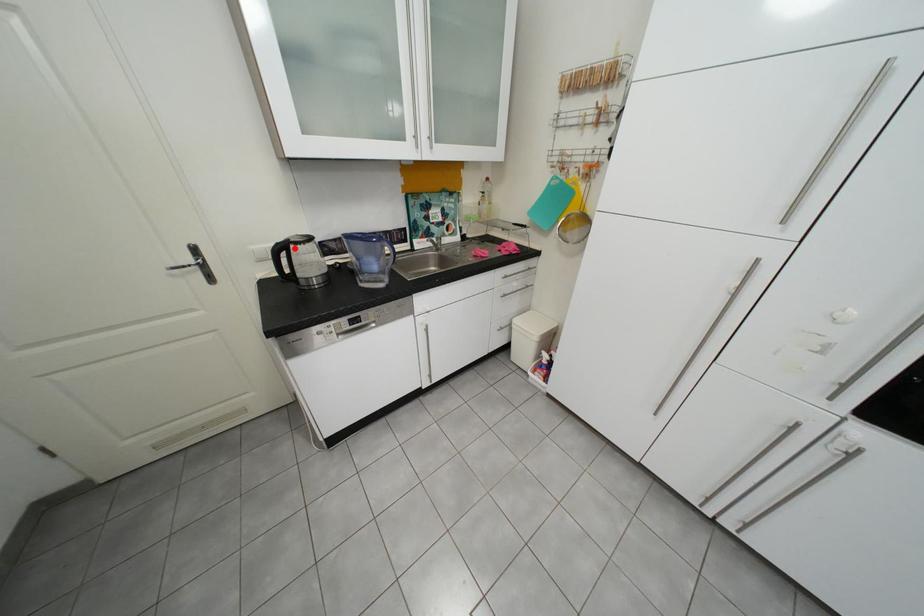
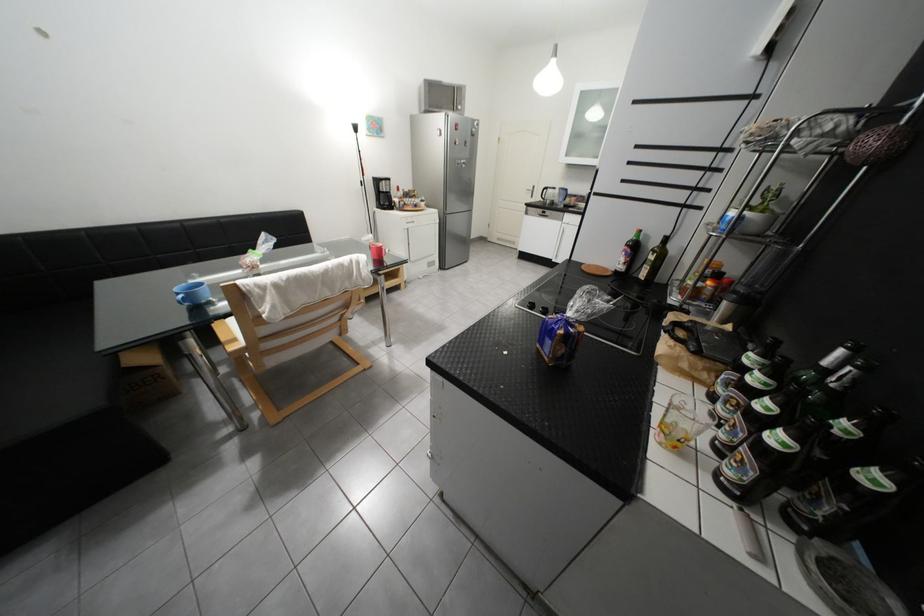
The point at the highlighted location is marked in the first image. Where is the corresponding point in the second image?

(557, 190)